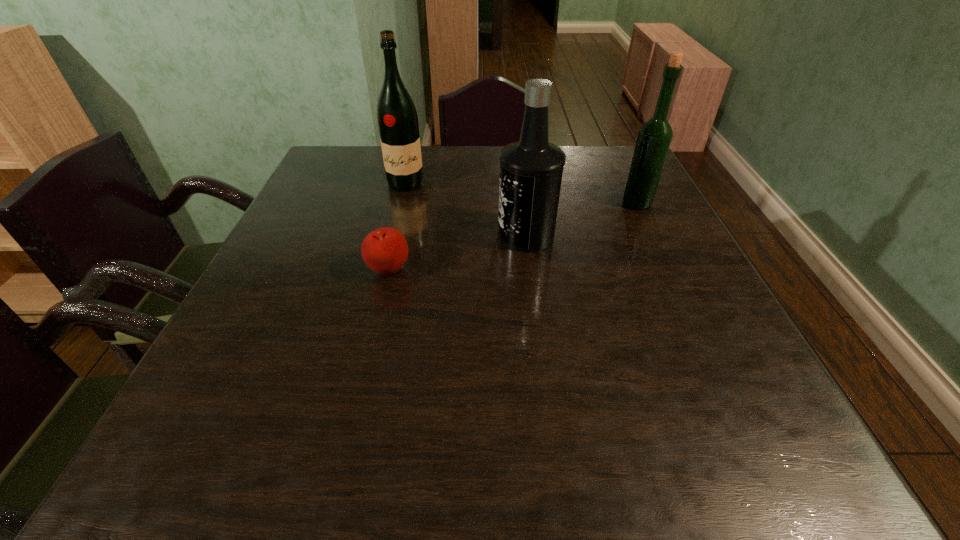
I want to click on the leftmost liquor, so click(x=397, y=118).

Locate an element on the screen. Image resolution: width=960 pixels, height=540 pixels. the farthest object is located at coordinates (397, 118).

At what (x,y) coordinates should I click in order to perform the action: click on the second farthest object. Please return your answer as a coordinate pair (x, y). This screenshot has height=540, width=960. Looking at the image, I should click on (654, 137).

Locate an element on the screen. the rightmost liquor is located at coordinates (654, 137).

The image size is (960, 540). What are the coordinates of `the nearest liquor` in the screenshot? It's located at (531, 169).

This screenshot has width=960, height=540. Identify the location of the second nearest object. (531, 169).

At what (x,y) coordinates should I click in order to perform the action: click on the shortest object. Please return your answer as a coordinate pair (x, y). The image size is (960, 540). Looking at the image, I should click on (385, 250).

The width and height of the screenshot is (960, 540). What are the coordinates of `apple` in the screenshot? It's located at (385, 250).

You are a GUI agent. You are given a task and a screenshot of the screen. Output one action in this format:
    pyautogui.click(x=<x>, y=<y>)
    Task: Click on the vacant point located 0.220m on the front-facing side of the farthest object
    The width and height of the screenshot is (960, 540).
    Given the screenshot: What is the action you would take?
    pyautogui.click(x=391, y=243)

You are a GUI agent. You are given a task and a screenshot of the screen. Output one action in this format:
    pyautogui.click(x=<x>, y=<y>)
    Task: Click on the free space located 0.170m on the back of the third nearest object
    This screenshot has width=960, height=540.
    Given the screenshot: What is the action you would take?
    pyautogui.click(x=618, y=165)